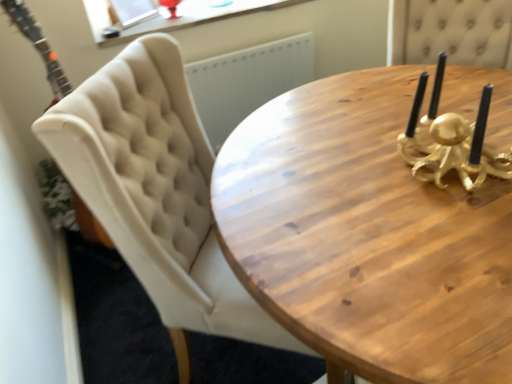
Question: Does beige tufted chair at upper left have a lesser height compared to wooden candle holder at upper right?

Choices:
 (A) no
 (B) yes

Answer: (A)

Question: Is beige tufted chair at upper left surrounding wooden candle holder at upper right?

Choices:
 (A) no
 (B) yes

Answer: (A)

Question: Can you confirm if beige tufted chair at upper left is wider than wooden candle holder at upper right?

Choices:
 (A) no
 (B) yes

Answer: (B)

Question: Does beige tufted chair at upper left have a smaller size compared to wooden candle holder at upper right?

Choices:
 (A) yes
 (B) no

Answer: (B)

Question: Considering the relative positions of beige tufted chair at upper left and wooden candle holder at upper right in the image provided, is beige tufted chair at upper left behind wooden candle holder at upper right?

Choices:
 (A) yes
 (B) no

Answer: (A)

Question: From the image's perspective, is beige tufted chair at upper left beneath wooden candle holder at upper right?

Choices:
 (A) yes
 (B) no

Answer: (B)

Question: Is wooden candle holder at upper right bigger than beige tufted chair at upper left?

Choices:
 (A) yes
 (B) no

Answer: (B)

Question: Is wooden candle holder at upper right wider than beige tufted chair at upper left?

Choices:
 (A) yes
 (B) no

Answer: (B)

Question: Is wooden candle holder at upper right oriented away from beige tufted chair at upper left?

Choices:
 (A) no
 (B) yes

Answer: (A)

Question: Does wooden candle holder at upper right turn towards beige tufted chair at upper left?

Choices:
 (A) no
 (B) yes

Answer: (A)

Question: Is wooden candle holder at upper right next to beige tufted chair at upper left?

Choices:
 (A) no
 (B) yes

Answer: (A)

Question: Would you say wooden candle holder at upper right contains beige tufted chair at upper left?

Choices:
 (A) no
 (B) yes

Answer: (A)

Question: From a real-world perspective, relative to wooden candle holder at upper right, is beige tufted chair at upper left vertically above or below?

Choices:
 (A) above
 (B) below

Answer: (B)